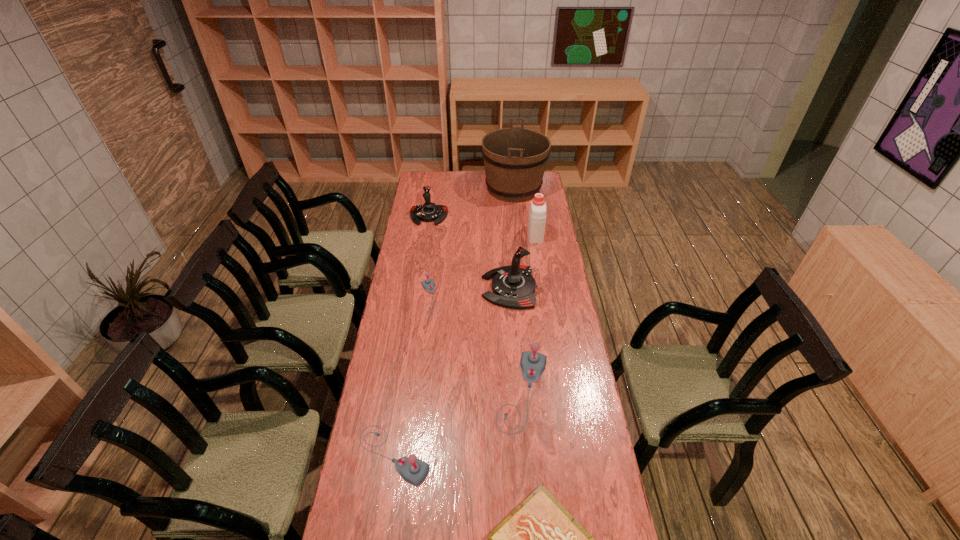
Locate an element on the screen. This screenshot has height=540, width=960. the third shortest object is located at coordinates (413, 470).

Find the location of a particular element. the shortest joystick is located at coordinates (429, 286).

This screenshot has height=540, width=960. Find the location of `the seventh tallest object`. the seventh tallest object is located at coordinates (429, 286).

At what (x,y) coordinates should I click in order to perform the action: click on vacant area located on the left of the bucket. Please return your answer as a coordinate pair (x, y). The width and height of the screenshot is (960, 540). Looking at the image, I should click on click(468, 188).

The width and height of the screenshot is (960, 540). Identify the location of free space located 0.200m on the handle side of the white detergent. (531, 205).

This screenshot has width=960, height=540. Identify the location of free spot located on the handle side of the white detergent. (529, 198).

Identify the location of blank space located 0.370m on the handle side of the white detergent. (528, 189).

Identify the location of vacant space located 0.350m on the handle side of the bigger red joystick. click(404, 288).

You are a GUI agent. You are given a task and a screenshot of the screen. Output one action in this format:
    pyautogui.click(x=<x>, y=<y>)
    Task: Click on the vacant area situated 0.160m on the handle side of the bigger red joystick
    The height and width of the screenshot is (540, 960).
    Given the screenshot: What is the action you would take?
    pyautogui.click(x=446, y=288)

I want to click on free region located 0.170m on the handle side of the bigger red joystick, so click(x=444, y=288).